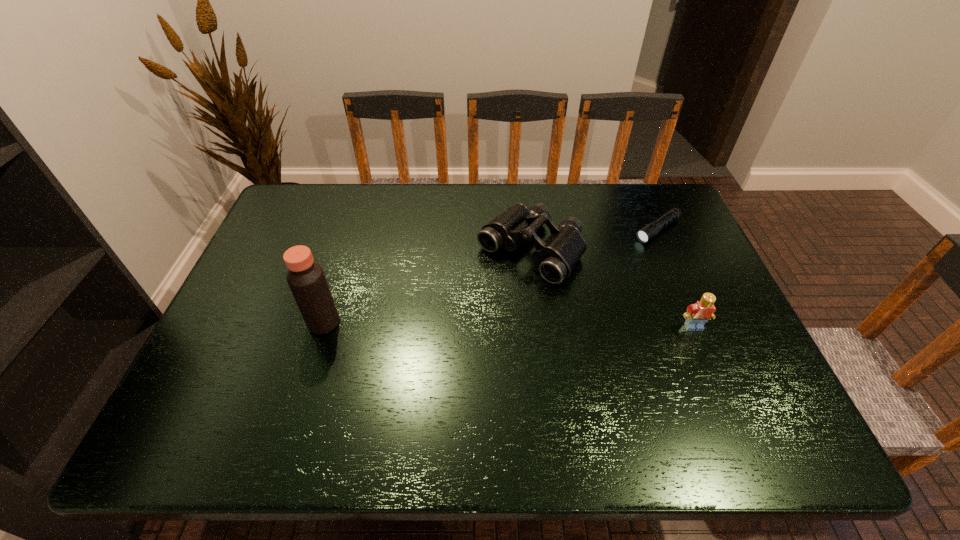
Locate an element on the screen. This screenshot has height=540, width=960. free location at the left edge is located at coordinates (258, 291).

I want to click on vacant region at the right edge, so click(719, 328).

The width and height of the screenshot is (960, 540). Identify the location of free point at the far left corner. (331, 185).

Where is `free region at the near right corner of the desktop`? The height and width of the screenshot is (540, 960). free region at the near right corner of the desktop is located at coordinates (732, 392).

At what (x,y) coordinates should I click in order to perform the action: click on unoccupied area between the flashlight and the binoculars. Please return your answer as a coordinate pair (x, y). This screenshot has height=540, width=960. Looking at the image, I should click on (593, 240).

At what (x,y) coordinates should I click in order to perform the action: click on unoccupied position between the shortest object and the leftmost object. Please return your answer as a coordinate pair (x, y). Looking at the image, I should click on (491, 276).

Locate an element on the screen. free space between the Lego and the shortest object is located at coordinates (676, 279).

This screenshot has width=960, height=540. Identify the location of vacant area that lies between the vinegar and the Lego. (509, 325).

Locate an element on the screen. The width and height of the screenshot is (960, 540). empty space between the second object from left to right and the shortest object is located at coordinates tap(593, 240).

The width and height of the screenshot is (960, 540). I want to click on free area in between the Lego and the shortest object, so click(676, 279).